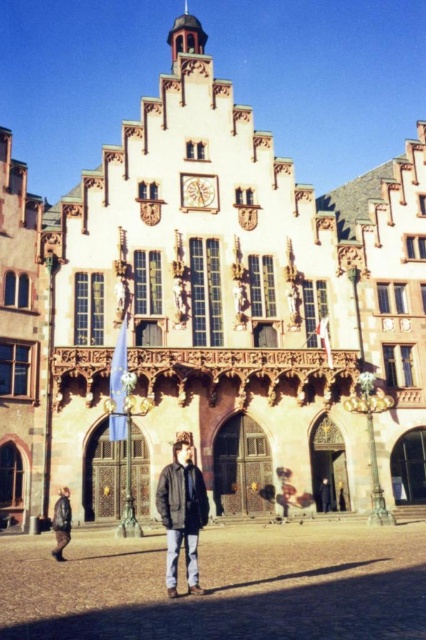
Does wooden carved clock at center appear over dark brown leather jacket at lower left?

Indeed, wooden carved clock at center is positioned over dark brown leather jacket at lower left.

Between wooden carved clock at center and dark brown leather jacket at lower left, which one is positioned lower?

dark brown leather jacket at lower left is below.

Is point (215, 198) closer to viewer compared to point (60, 504)?

No.

Identify the location of wooden carved clock at center. The width and height of the screenshot is (426, 640). (198, 192).

Based on the photo, does dark brown leather jacket at lower left have a greater width compared to dark gray jacket at center?

Yes, dark brown leather jacket at lower left is wider than dark gray jacket at center.

Between point (52, 554) and point (321, 499), which one is positioned in front?

Point (52, 554) is in front.

This screenshot has width=426, height=640. What are the coordinates of `dark brown leather jacket at lower left` in the screenshot? It's located at (62, 522).

Who is lower down, dark brown stone building at left or dark brown leather jacket at center?

dark brown leather jacket at center

Between point (23, 228) and point (170, 532), which one is positioned in front?

Point (170, 532) is in front.

Measure the distance between dark brown stone building at left and camera.

dark brown stone building at left is 40.47 meters from camera.

The height and width of the screenshot is (640, 426). I want to click on dark brown stone building at left, so click(19, 340).